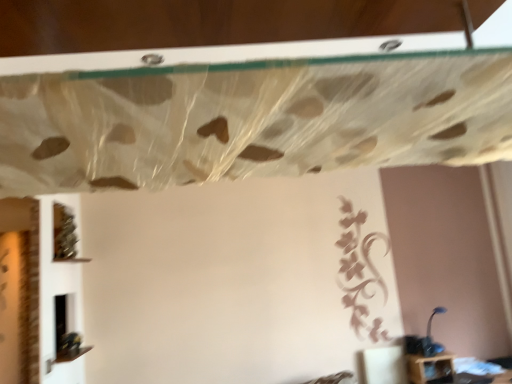
Question: Does green matte vine at lower left come in front of translucent plastic curtain at upper center?

Choices:
 (A) yes
 (B) no

Answer: (B)

Question: From a real-world perspective, is green matte vine at lower left located higher than translucent plastic curtain at upper center?

Choices:
 (A) yes
 (B) no

Answer: (A)

Question: Is green matte vine at lower left looking in the opposite direction of translucent plastic curtain at upper center?

Choices:
 (A) no
 (B) yes

Answer: (A)

Question: From a real-world perspective, is green matte vine at lower left under translucent plastic curtain at upper center?

Choices:
 (A) no
 (B) yes

Answer: (A)

Question: Can you confirm if green matte vine at lower left is bigger than translucent plastic curtain at upper center?

Choices:
 (A) no
 (B) yes

Answer: (A)

Question: Is green matte vine at lower left next to translucent plastic curtain at upper center and touching it?

Choices:
 (A) yes
 (B) no

Answer: (B)

Question: Could you tell me if translucent plastic curtain at upper center is facing green matte vine at lower left?

Choices:
 (A) yes
 (B) no

Answer: (A)

Question: Does translucent plastic curtain at upper center have a smaller size compared to green matte vine at lower left?

Choices:
 (A) no
 (B) yes

Answer: (A)

Question: Does translucent plastic curtain at upper center have a lesser height compared to green matte vine at lower left?

Choices:
 (A) yes
 (B) no

Answer: (A)

Question: Would you consider translucent plastic curtain at upper center to be distant from green matte vine at lower left?

Choices:
 (A) no
 (B) yes

Answer: (B)

Question: Considering the relative sizes of translucent plastic curtain at upper center and green matte vine at lower left in the image provided, is translucent plastic curtain at upper center bigger than green matte vine at lower left?

Choices:
 (A) no
 (B) yes

Answer: (B)

Question: Is translucent plastic curtain at upper center facing away from green matte vine at lower left?

Choices:
 (A) no
 (B) yes

Answer: (A)

Question: Considering the relative sizes of translucent plastic curtain at upper center and blue plastic lamp at lower right in the image provided, is translucent plastic curtain at upper center wider than blue plastic lamp at lower right?

Choices:
 (A) yes
 (B) no

Answer: (A)